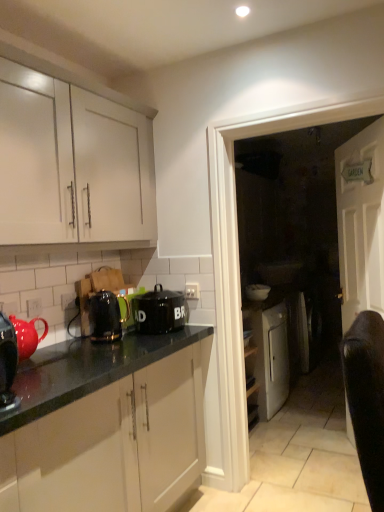
Question: Is shiny black kettle at left, placed as the 1th kitchen appliance when sorted from left to right, wider or thinner than white glossy bowl at center?

Choices:
 (A) thin
 (B) wide

Answer: (A)

Question: Looking at the image, does shiny black kettle at left, positioned as the 1th kitchen appliance in front-to-back order, seem bigger or smaller compared to white glossy bowl at center?

Choices:
 (A) big
 (B) small

Answer: (B)

Question: Estimate the real-world distances between objects in this image. Which object is farther from the white wooden door at center?

Choices:
 (A) black ceramic canister at center, which is counted as the 1th kitchen appliance, starting from the right
 (B) metallic black toaster at center-left, arranged as the second kitchen appliance when viewed from the back
 (C) white glossy door at center
 (D) white glossy bowl at center
 (E) white matte cabinet at upper left

Answer: (E)

Question: Based on their relative distances, which object is farther from the black ceramic canister at center, the 3th kitchen appliance viewed from the left?

Choices:
 (A) shiny black kettle at left, placed as the third kitchen appliance when sorted from right to left
 (B) white glossy door at center
 (C) white matte cabinet at upper left
 (D) white glossy bowl at center
 (E) metallic black toaster at center-left, the second kitchen appliance from the right

Answer: (D)